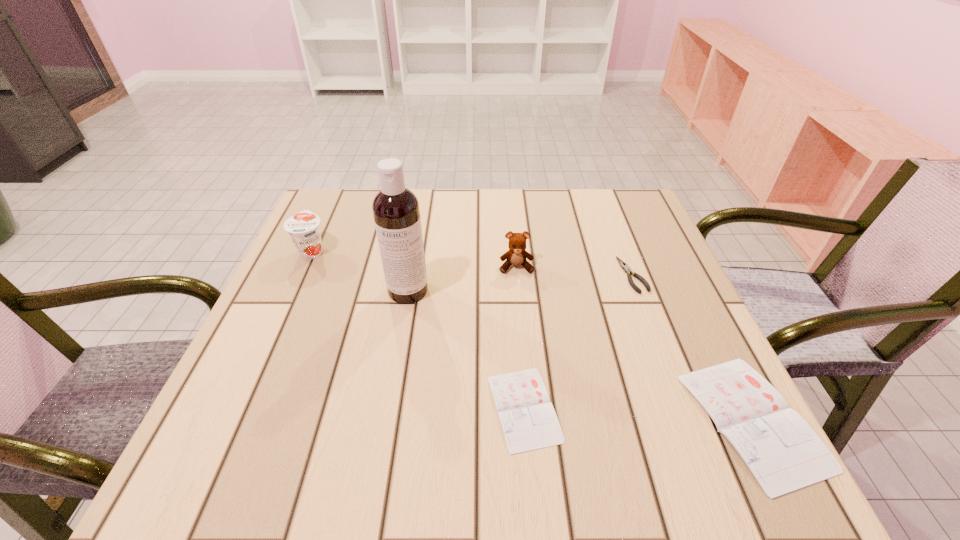
Locate an element on the screen. The height and width of the screenshot is (540, 960). the shorter diary is located at coordinates (528, 419).

Find the location of a particular element. the left diary is located at coordinates (528, 419).

Locate an element on the screen. This screenshot has height=540, width=960. the right diary is located at coordinates (783, 452).

At what (x,y) coordinates should I click in order to perform the action: click on the taller diary. Please return your answer as a coordinate pair (x, y). Image resolution: width=960 pixels, height=540 pixels. Looking at the image, I should click on (783, 452).

Where is `yogurt`? The image size is (960, 540). yogurt is located at coordinates (303, 228).

The image size is (960, 540). Identify the location of the fifth object from right to left. (396, 212).

Find the location of `dishwasher detergent`. dishwasher detergent is located at coordinates (396, 212).

The image size is (960, 540). What are the coordinates of `the fifth tallest object` in the screenshot? It's located at (623, 265).

Where is `teddy bear`? This screenshot has height=540, width=960. teddy bear is located at coordinates (516, 255).

This screenshot has height=540, width=960. What are the coordinates of `vacant space located 0.280m on the right of the shorter diary` in the screenshot? It's located at (724, 408).